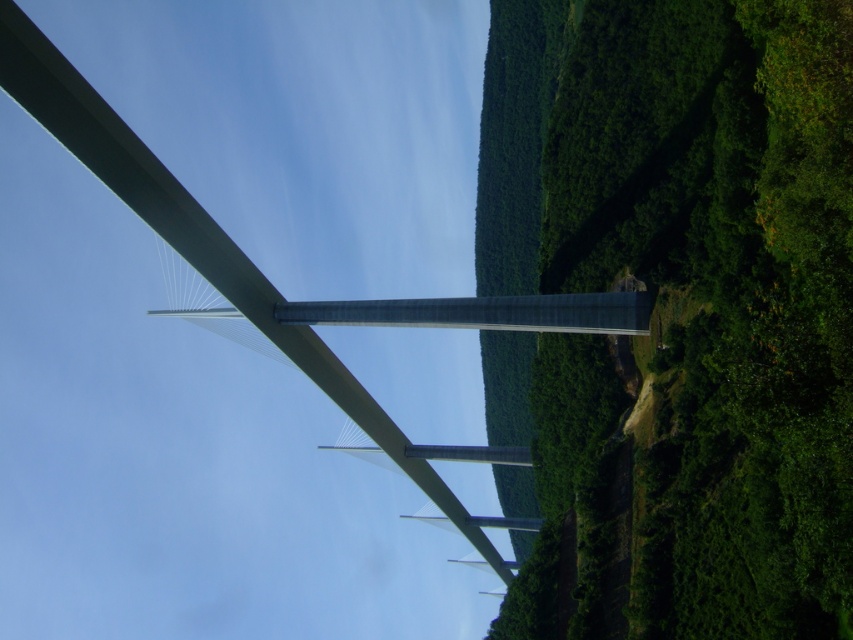
Identify the location of green leafy tree at right. (677, 308).

Which is more to the right, green leafy tree at right or metallic gray bridge at center?

green leafy tree at right is more to the right.

In order to click on green leafy tree at right in this screenshot , I will do `click(677, 308)`.